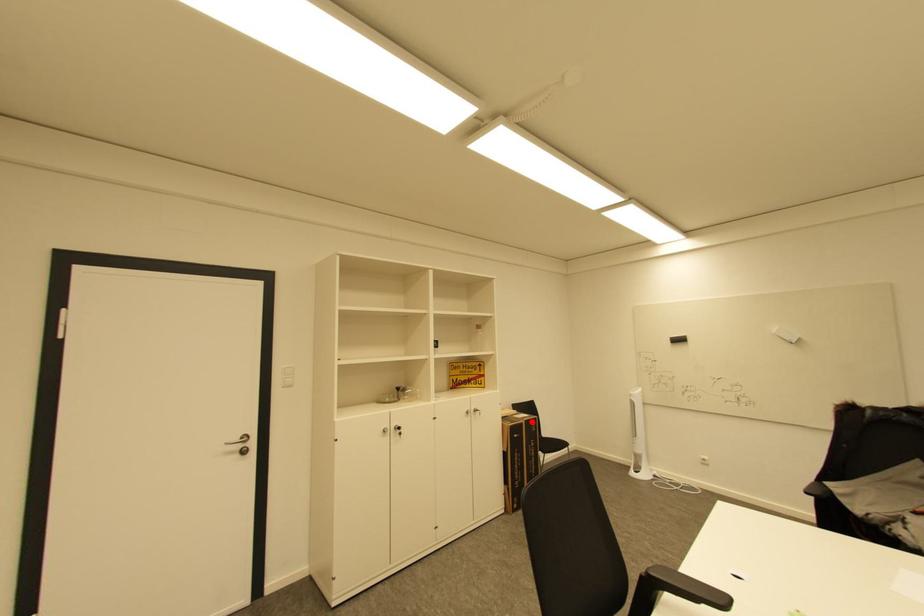
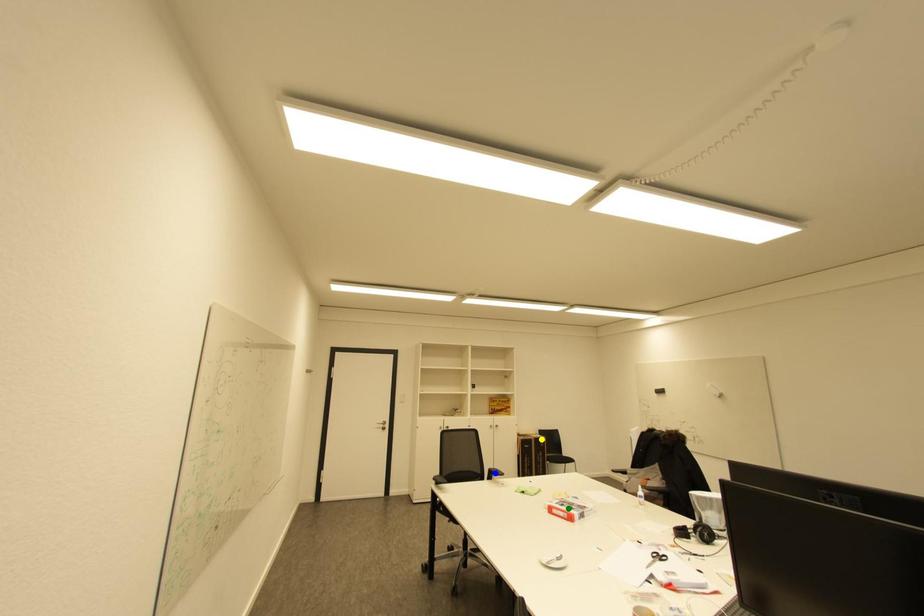
Question: I am providing you with two images of the same scene from different viewpoints. A red point is marked on the first image. You are given multiple points on the second image. Which point in image 2 represents the same 3d spot as the red point in image 1?

Choices:
 (A) blue point
 (B) yellow point
 (C) green point

Answer: (B)